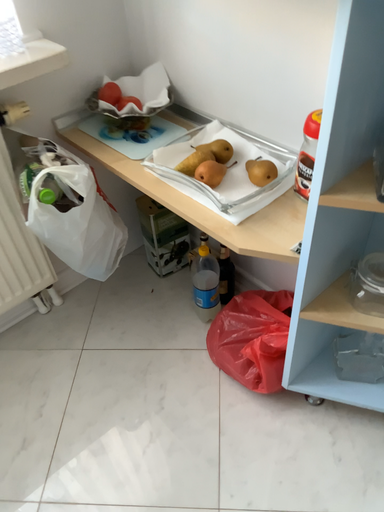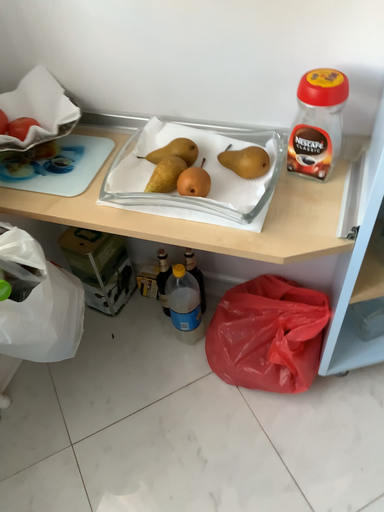
Question: How did the camera likely rotate when shooting the video?

Choices:
 (A) rotated right
 (B) rotated left

Answer: (A)